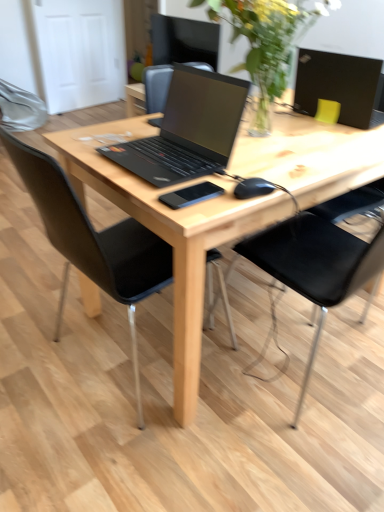
The image size is (384, 512). What do you see at coordinates (191, 195) in the screenshot?
I see `black matte phone at center` at bounding box center [191, 195].

Measure the distance between point (56, 145) and camera.

Point (56, 145) is 1.34 meters from camera.

The height and width of the screenshot is (512, 384). What do you see at coordinates (188, 129) in the screenshot?
I see `black matte laptop at center, which is the 1th laptop from left to right` at bounding box center [188, 129].

Describe the element at coordinates (338, 84) in the screenshot. I see `black matte laptop at upper right, placed as the 2th laptop when sorted from left to right` at that location.

What do you see at coordinates (253, 188) in the screenshot? Image resolution: width=384 pixels, height=512 pixels. I see `black matte mouse at center` at bounding box center [253, 188].

The image size is (384, 512). What are the coordinates of `translucent glass vase at center` in the screenshot? It's located at (266, 42).

Considering the relative positions of black matte laptop at upper right, the second laptop from the front, and translucent glass vase at center in the image provided, is black matte laptop at upper right, the second laptop from the front, in front of translucent glass vase at center?

No.

Can we say black matte laptop at upper right, placed as the 2th laptop when sorted from left to right, lies outside translucent glass vase at center?

Indeed, black matte laptop at upper right, placed as the 2th laptop when sorted from left to right, is completely outside translucent glass vase at center.

From a real-world perspective, who is located higher, black matte laptop at upper right, the first laptop when ordered from back to front, or translucent glass vase at center?

In real-world perspective, translucent glass vase at center is above.

Is black matte laptop at upper right, placed as the 2th laptop when sorted from left to right, looking in the opposite direction of translucent glass vase at center?

Yes.

Is translucent glass vase at center in front of or behind black leather chair at center, which is counted as the 2th chair, starting from the right, in the image?

translucent glass vase at center is positioned farther from the viewer than black leather chair at center, which is counted as the 2th chair, starting from the right.

Is translucent glass vase at center aimed at black leather chair at center, which is counted as the 2th chair, starting from the right?

No, translucent glass vase at center does not turn towards black leather chair at center, which is counted as the 2th chair, starting from the right.

From the image's perspective, is translucent glass vase at center positioned above or below black leather chair at center, which is counted as the 2th chair, starting from the right?

translucent glass vase at center is situated higher than black leather chair at center, which is counted as the 2th chair, starting from the right, in the image.

Would you consider black matte phone at center to be distant from black leather chair at center, which is counted as the 2th chair, starting from the right?

Actually, black matte phone at center and black leather chair at center, which is counted as the 2th chair, starting from the right, are a little close together.

From a real-world perspective, is black matte phone at center over black leather chair at center, which ranks as the 1th chair in left-to-right order?

Yes, from a real-world perspective, black matte phone at center is on top of black leather chair at center, which ranks as the 1th chair in left-to-right order.

Is black matte phone at center situated inside black leather chair at center, which ranks as the 1th chair in left-to-right order, or outside?

black matte phone at center lies outside black leather chair at center, which ranks as the 1th chair in left-to-right order.

From the image's perspective, is black matte phone at center above or below black leather chair at center, which is counted as the 2th chair, starting from the right?

Clearly, from the image's perspective, black matte phone at center is above black leather chair at center, which is counted as the 2th chair, starting from the right.

From a real-world perspective, between black matte phone at center and translucent glass vase at center, who is vertically lower?

black matte phone at center, from a real-world perspective.

From the image's perspective, is black matte phone at center over translucent glass vase at center?

Actually, black matte phone at center appears below translucent glass vase at center in the image.

Identify the location of floral arrangement on the right of black matte phone at center. pos(266,42).

Could you tell me if translucent glass vase at center is turned towards black matte laptop at center, which is counted as the 1th laptop, starting from the front?

No, translucent glass vase at center is not aimed at black matte laptop at center, which is counted as the 1th laptop, starting from the front.

From the image's perspective, is translucent glass vase at center above or below black matte laptop at center, which is the second laptop in right-to-left order?

From the image's perspective, translucent glass vase at center appears above black matte laptop at center, which is the second laptop in right-to-left order.

Which object is wider, translucent glass vase at center or black matte laptop at center, which is counted as the 1th laptop, starting from the front?

translucent glass vase at center.

Where is `floral arrangement that is behind the black matte laptop at center, which is counted as the 1th laptop, starting from the front`? floral arrangement that is behind the black matte laptop at center, which is counted as the 1th laptop, starting from the front is located at coordinates (266, 42).

Is black matte laptop at upper right, the second laptop from the front, directly adjacent to black matte laptop at center, which is counted as the 1th laptop, starting from the front?

No, black matte laptop at upper right, the second laptop from the front, is not beside black matte laptop at center, which is counted as the 1th laptop, starting from the front.

Who is taller, black matte laptop at upper right, arranged as the first laptop when viewed from the right, or black matte laptop at center, placed as the 2th laptop when sorted from back to front?

black matte laptop at upper right, arranged as the first laptop when viewed from the right, is taller.

From the image's perspective, does black matte laptop at upper right, the second laptop from the front, appear lower than black matte laptop at center, which is counted as the 1th laptop, starting from the front?

No, from the image's perspective, black matte laptop at upper right, the second laptop from the front, is not beneath black matte laptop at center, which is counted as the 1th laptop, starting from the front.

From a real-world perspective, is black matte laptop at upper right, the second laptop from the front, on black matte laptop at center, which is the second laptop in right-to-left order?

Yes.

Is black matte mouse at center wider than black leather chair at center, acting as the 2th chair starting from the left?

In fact, black matte mouse at center might be narrower than black leather chair at center, acting as the 2th chair starting from the left.

Which is behind, point (273, 185) or point (322, 310)?

The point (322, 310) is farther from the camera.

Is black matte mouse at center taller or shorter than black leather chair at center, which is counted as the 1th chair, starting from the right?

In the image, black matte mouse at center appears to be shorter than black leather chair at center, which is counted as the 1th chair, starting from the right.

Between black matte mouse at center and black leather chair at center, which is counted as the 1th chair, starting from the right, which one has larger size?

Bigger between the two is black leather chair at center, which is counted as the 1th chair, starting from the right.

At what (x,y) coordinates should I click in order to perform the action: click on laptop that is the 1st object directly below the translucent glass vase at center (from a real-world perspective). Please return your answer as a coordinate pair (x, y). Looking at the image, I should click on (338, 84).

This screenshot has height=512, width=384. In order to click on chair that is the 2nd one when counting forward from the translucent glass vase at center in this screenshot , I will do `click(93, 242)`.

Which object lies further to the anchor point black leather chair at center, which ranks as the 1th chair in left-to-right order, translucent glass vase at center or black matte laptop at upper right, the second laptop from the front?

Based on the image, black matte laptop at upper right, the second laptop from the front, appears to be further to black leather chair at center, which ranks as the 1th chair in left-to-right order.

Considering their positions, is black matte laptop at center, placed as the 2th laptop when sorted from back to front, positioned further to black leather chair at center, which is counted as the 1th chair, starting from the right, than black matte phone at center?

The object further to black leather chair at center, which is counted as the 1th chair, starting from the right, is black matte phone at center.

Based on their spatial positions, is black matte laptop at center, which is counted as the 1th laptop, starting from the front, or natural wood desk at center further from black matte phone at center?

natural wood desk at center is positioned further to the anchor black matte phone at center.

When comparing their distances from translucent glass vase at center, does black leather chair at center, acting as the 2th chair starting from the left, or black matte laptop at upper right, the first laptop when ordered from back to front, seem further?

black leather chair at center, acting as the 2th chair starting from the left, is further to translucent glass vase at center.

Considering their positions, is black matte laptop at center, placed as the 2th laptop when sorted from back to front, positioned closer to translucent glass vase at center than black leather chair at center, which ranks as the 1th chair in left-to-right order?

black matte laptop at center, placed as the 2th laptop when sorted from back to front, is positioned closer to the anchor translucent glass vase at center.

Consider the image. When comparing their distances from black matte mouse at center, does black leather chair at center, which ranks as the 1th chair in left-to-right order, or black matte phone at center seem closer?

black matte phone at center lies closer to black matte mouse at center than the other object.

From the image, which object appears to be farther from black matte mouse at center, black matte phone at center or natural wood desk at center?

natural wood desk at center lies further to black matte mouse at center than the other object.

From the image, which object appears to be farther from black matte mouse at center, black matte laptop at center, which is the 1th laptop from left to right, or black matte phone at center?

Among the two, black matte laptop at center, which is the 1th laptop from left to right, is located further to black matte mouse at center.

Identify the location of mouse between black matte laptop at center, which is counted as the 1th laptop, starting from the front, and black matte phone at center in the up-down direction. The width and height of the screenshot is (384, 512). (253, 188).

Image resolution: width=384 pixels, height=512 pixels. Identify the location of mobile phone between black leather chair at center, which ranks as the 1th chair in left-to-right order, and black leather chair at center, which is counted as the 1th chair, starting from the right. (191, 195).

Find the location of a particular element. This screenshot has height=512, width=384. mouse between black matte laptop at upper right, arranged as the first laptop when viewed from the right, and black leather chair at center, acting as the 2th chair starting from the left, in the up-down direction is located at coordinates (253, 188).

Locate an element on the screen. mouse between translucent glass vase at center and black leather chair at center, which is counted as the 2th chair, starting from the right, in the up-down direction is located at coordinates (253, 188).